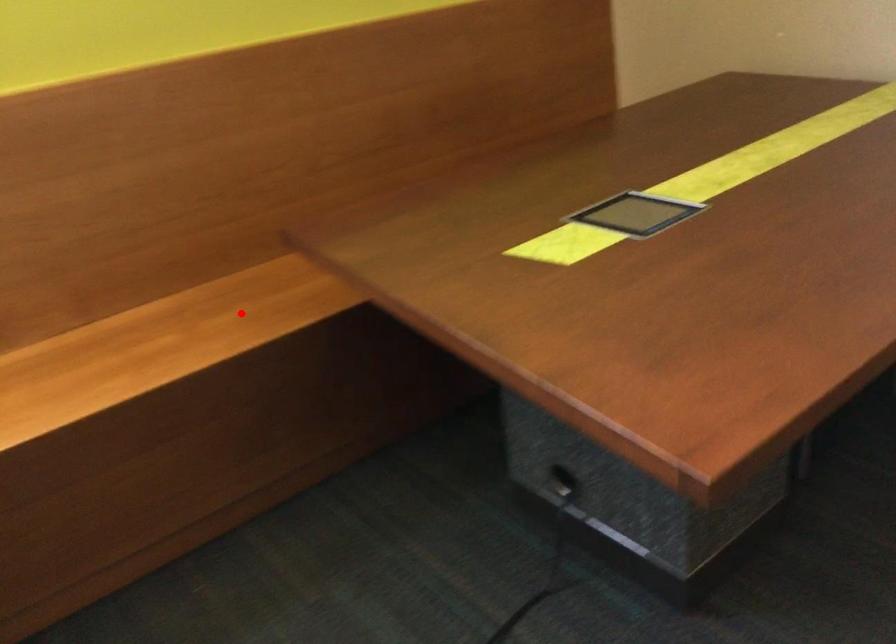
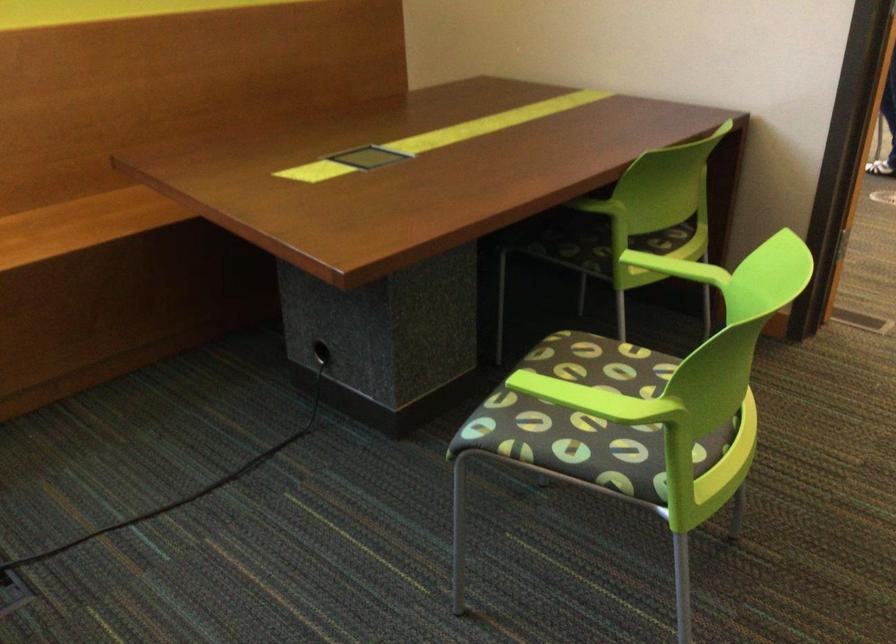
Question: I am providing you with two images of the same scene from different viewpoints. Image1 has a red point marked. In image2, the corresponding 3D location appears at what relative position? Reply with the corresponding letter.

Choices:
 (A) Closer
 (B) Farther

Answer: (B)